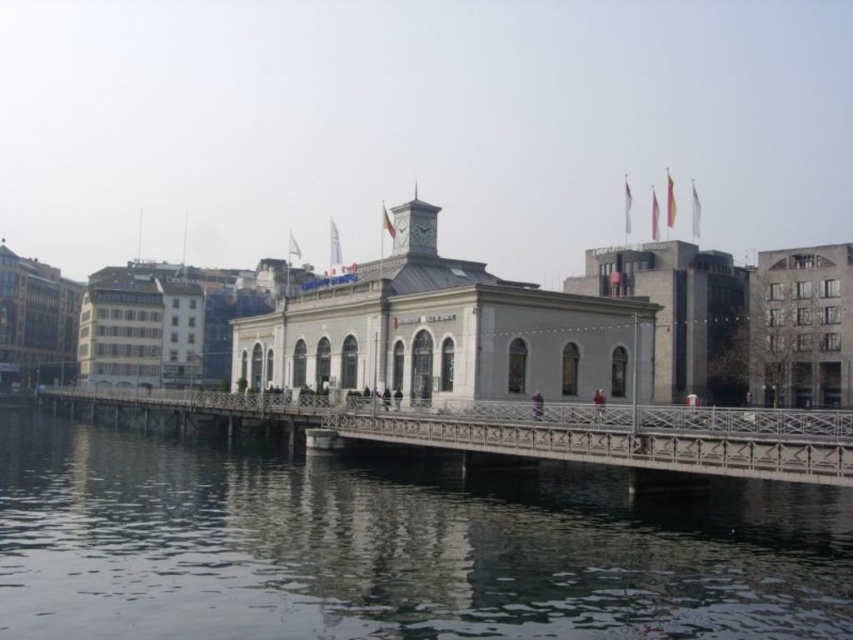
Question: Among these points, which one is nearest to the camera?

Choices:
 (A) (718, 570)
 (B) (843, 435)

Answer: (A)

Question: Which point is farther to the camera?

Choices:
 (A) (689, 595)
 (B) (450, 417)

Answer: (B)

Question: Is smooth dark water at lower center to the right of metallic gray bridge at center from the viewer's perspective?

Choices:
 (A) no
 (B) yes

Answer: (A)

Question: Can you confirm if smooth dark water at lower center is thinner than metallic gray bridge at center?

Choices:
 (A) yes
 (B) no

Answer: (A)

Question: Can you confirm if smooth dark water at lower center is positioned above metallic gray bridge at center?

Choices:
 (A) yes
 (B) no

Answer: (B)